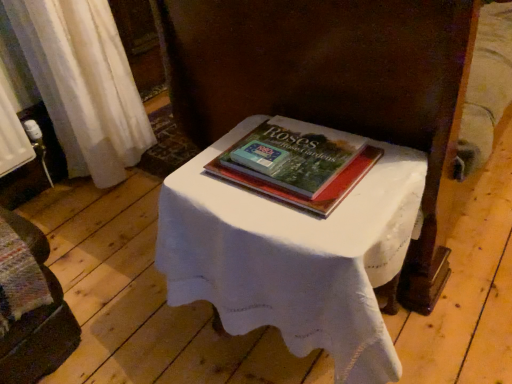
This screenshot has width=512, height=384. In order to click on free space above hardcover book at center (from a real-world perspective) in this screenshot , I will do `click(291, 148)`.